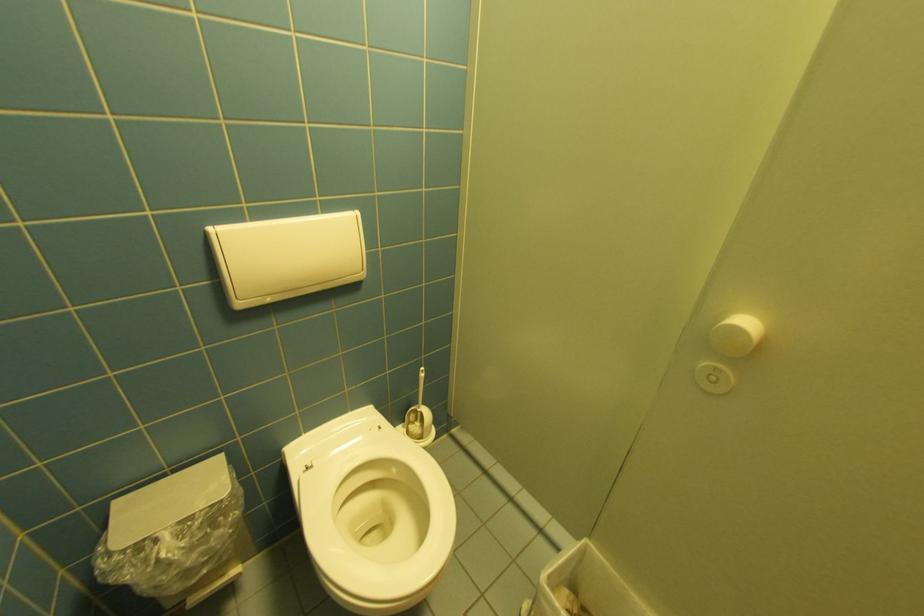
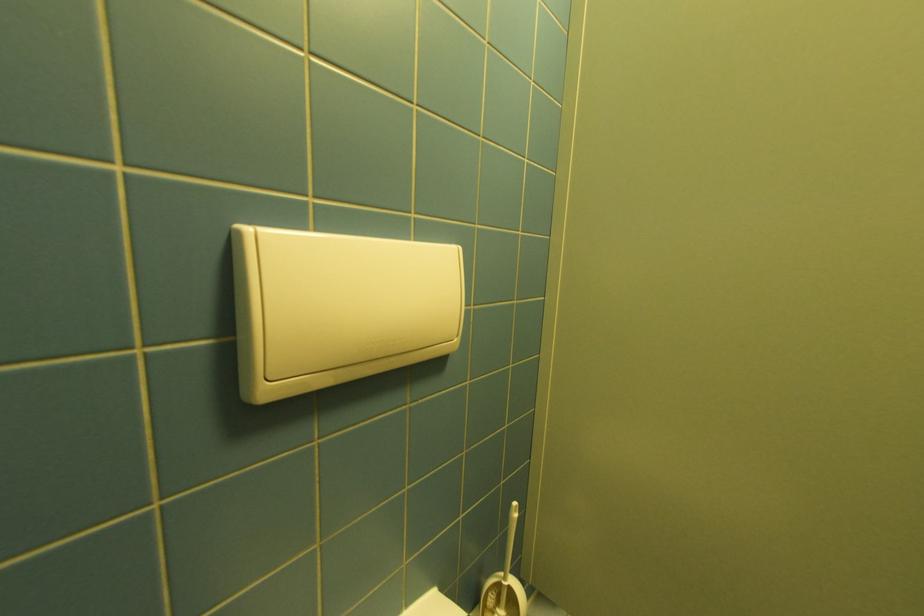
The images are taken continuously from a first-person perspective. In which direction are you moving?

The cameraman walked toward left, forward.